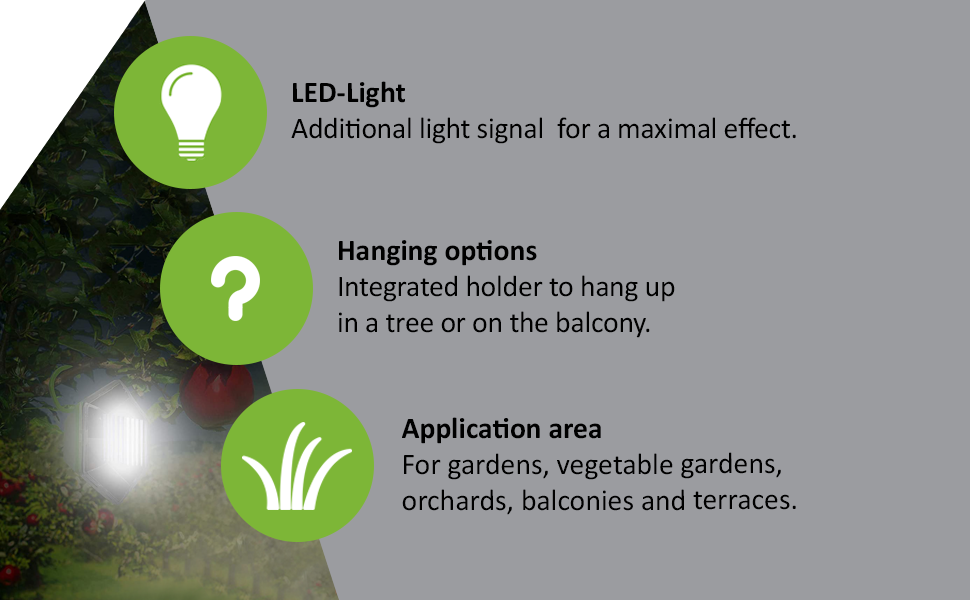
Where is `lightbulb`? lightbulb is located at coordinates (192, 110).